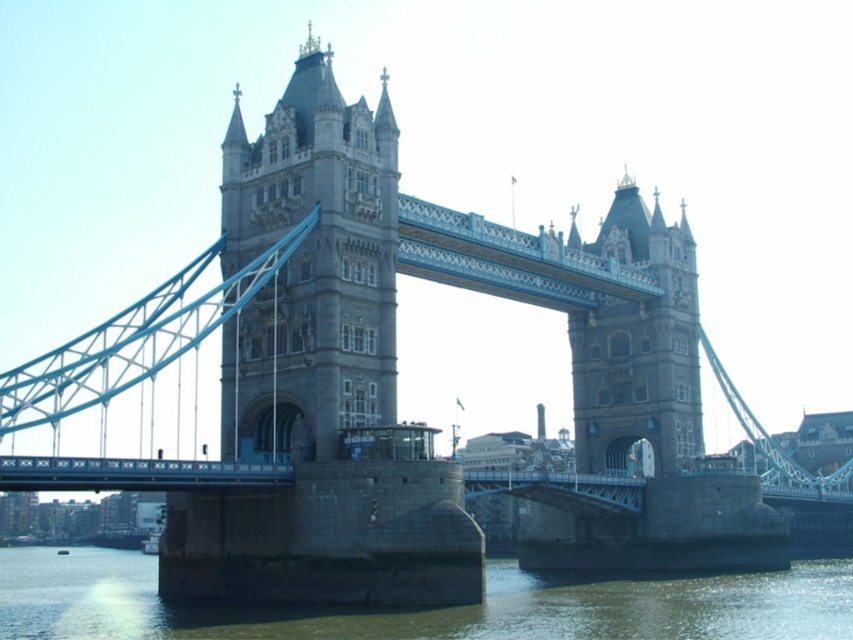
Question: Where is gray stone tower at center located in relation to greenish concrete river at lower center in the image?

Choices:
 (A) right
 (B) left

Answer: (A)

Question: Which of the following is the farthest from the observer?

Choices:
 (A) stone stonework tower at center
 (B) greenish concrete river at lower center
 (C) gray stone tower at center

Answer: (A)

Question: Is gray stone tower at center above greenish concrete river at lower center?

Choices:
 (A) yes
 (B) no

Answer: (A)

Question: Is gray stone tower at center wider than stone stonework tower at center?

Choices:
 (A) yes
 (B) no

Answer: (A)

Question: Which of these objects is positioned closest to the stone stonework tower at center?

Choices:
 (A) greenish concrete river at lower center
 (B) gray stone tower at center

Answer: (A)

Question: Among these objects, which one is nearest to the camera?

Choices:
 (A) gray stone tower at center
 (B) stone stonework tower at center
 (C) greenish concrete river at lower center

Answer: (C)